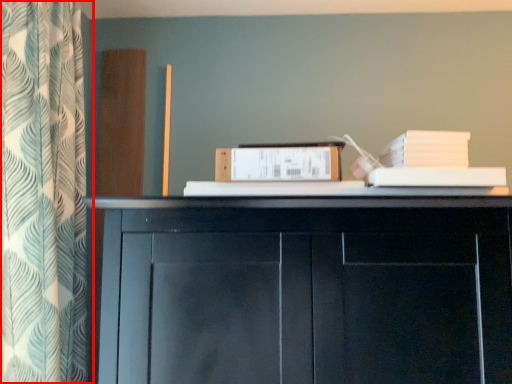
Question: Considering the relative positions of curtain (annotated by the red box) and paperback book in the image provided, where is curtain (annotated by the red box) located with respect to the staircase?

Choices:
 (A) right
 (B) left

Answer: (B)